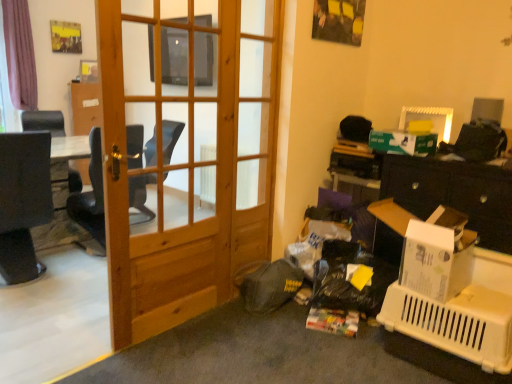
This screenshot has height=384, width=512. What are the coordinates of `natural wood door at center` in the screenshot? It's located at (187, 152).

What is the approximate width of matte black speaker at upper right?

The width of matte black speaker at upper right is 7.56 inches.

Describe the element at coordinates (487, 109) in the screenshot. Image resolution: width=512 pixels, height=384 pixels. I see `matte black speaker at upper right` at that location.

Measure the distance between white cardboard box at right and camera.

white cardboard box at right and camera are 1.88 meters apart.

This screenshot has height=384, width=512. What are the coordinates of `green cardboard box at upper right` in the screenshot? It's located at click(403, 143).

In the image, is white plastic picture frame at upper right on the left side or the right side of natural wood door at center?

white plastic picture frame at upper right is positioned on natural wood door at center's right side.

Can you confirm if white plastic picture frame at upper right is shorter than natural wood door at center?

Correct, white plastic picture frame at upper right is not as tall as natural wood door at center.

Does point (438, 123) lie in front of point (181, 301)?

That is False.

Is point (32, 129) positioned before point (399, 153)?

No, (32, 129) is behind (399, 153).

Based on the photo, from a real-world perspective, is black leather chair at left positioned under green cardboard box at upper right based on gravity?

Indeed, from a real-world perspective, black leather chair at left is positioned beneath green cardboard box at upper right.

Is black leather chair at left positioned far away from green cardboard box at upper right?

Yes, black leather chair at left and green cardboard box at upper right are located far from each other.

Is black leather chair at left to the left or to the right of green cardboard box at upper right in the image?

In the image, black leather chair at left appears on the left side of green cardboard box at upper right.

Would you say natural wood door at center is inside or outside black leather chair at left?

natural wood door at center is spatially situated outside black leather chair at left.

From the image's perspective, between natural wood door at center and black leather chair at left, who is located below?

natural wood door at center appears lower in the image.

From a real-world perspective, is natural wood door at center physically below black leather chair at left?

Incorrect, from a real-world perspective, natural wood door at center is higher than black leather chair at left.

Is natural wood door at center thinner than black leather chair at left?

Yes.

Is natural wood door at center turned away from white plastic picture frame at upper right?

No, natural wood door at center's orientation is not away from white plastic picture frame at upper right.

Can we say natural wood door at center lies outside white plastic picture frame at upper right?

That's correct, natural wood door at center is outside of white plastic picture frame at upper right.

Is natural wood door at center in contact with white plastic picture frame at upper right?

natural wood door at center and white plastic picture frame at upper right are not in contact.

In the scene shown: Can you confirm if natural wood door at center is positioned to the right of white plastic picture frame at upper right?

No, natural wood door at center is not to the right of white plastic picture frame at upper right.

From the image's perspective, is white cardboard box at right over white plastic picture frame at upper right?

No.

Considering the relative positions of white cardboard box at right and white plastic picture frame at upper right in the image provided, is white cardboard box at right to the left of white plastic picture frame at upper right from the viewer's perspective?

Correct, you'll find white cardboard box at right to the left of white plastic picture frame at upper right.

Is white cardboard box at right aimed at white plastic picture frame at upper right?

No, white cardboard box at right is not aimed at white plastic picture frame at upper right.

Is matte black speaker at upper right thinner than white cardboard box at right?

Yes, matte black speaker at upper right is thinner than white cardboard box at right.

Considering the sizes of objects matte black speaker at upper right and white cardboard box at right in the image provided, who is smaller, matte black speaker at upper right or white cardboard box at right?

matte black speaker at upper right is smaller.

Is point (473, 107) farther from viewer compared to point (421, 226)?

Yes, it is behind point (421, 226).

Find the location of `cardboard box on the left side of matte black speaker at upper right`. cardboard box on the left side of matte black speaker at upper right is located at coordinates (437, 255).

From the image's perspective, between natural wood door at center and matte black speaker at upper right, who is located below?

natural wood door at center, from the image's perspective.

Does natural wood door at center appear on the left side of matte black speaker at upper right?

Yes.

Is natural wood door at center facing towards matte black speaker at upper right?

No, natural wood door at center does not turn towards matte black speaker at upper right.

Considering the sizes of objects natural wood door at center and matte black speaker at upper right in the image provided, who is taller, natural wood door at center or matte black speaker at upper right?

With more height is natural wood door at center.

Locate an element on the screen. The height and width of the screenshot is (384, 512). door below the white plastic picture frame at upper right (from the image's perspective) is located at coordinates (187, 152).

At what (x,y) coordinates should I click in order to perform the action: click on box in front of the black leather chair at left. Please return your answer as a coordinate pair (x, y). Looking at the image, I should click on (403, 143).

Estimate the real-world distances between objects in this image. Which object is further from white plastic picture frame at upper right, natural wood door at center or white cardboard box at right?

natural wood door at center is further to white plastic picture frame at upper right.

In the scene shown: Looking at the image, which one is located further to black leather chair at left, natural wood door at center or white plastic picture frame at upper right?

Among the two, white plastic picture frame at upper right is located further to black leather chair at left.

Based on their spatial positions, is white cardboard box at right or natural wood door at center closer to matte black speaker at upper right?

white cardboard box at right is positioned closer to the anchor matte black speaker at upper right.

Which object lies nearer to the anchor point black leather chair at left, white plastic picture frame at upper right or white cardboard box at right?

The object closer to black leather chair at left is white plastic picture frame at upper right.

Considering their positions, is black leather chair at left positioned further to white cardboard box at right than natural wood door at center?

Based on the image, black leather chair at left appears to be further to white cardboard box at right.

Looking at the image, which one is located closer to green cardboard box at upper right, matte black speaker at upper right or white plastic picture frame at upper right?

Based on the image, white plastic picture frame at upper right appears to be nearer to green cardboard box at upper right.

From the image, which object appears to be farther from matte black speaker at upper right, green cardboard box at upper right or natural wood door at center?

natural wood door at center is further to matte black speaker at upper right.

From the image, which object appears to be farther from green cardboard box at upper right, white plastic picture frame at upper right or natural wood door at center?

natural wood door at center is further to green cardboard box at upper right.

Locate an element on the screen. box located between white cardboard box at right and white plastic picture frame at upper right in the depth direction is located at coordinates click(x=403, y=143).

I want to click on door located between black leather chair at left and green cardboard box at upper right in the left-right direction, so click(x=187, y=152).

Find the location of a particular element. This screenshot has height=384, width=512. door between black leather chair at left and white plastic picture frame at upper right is located at coordinates (187, 152).

Identify the location of door between black leather chair at left and matte black speaker at upper right from left to right. This screenshot has height=384, width=512. (187, 152).